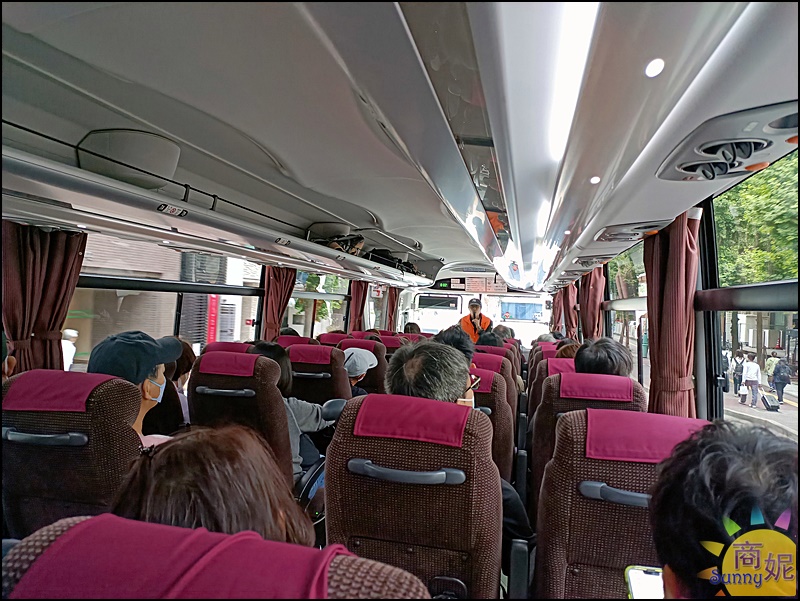
The width and height of the screenshot is (800, 601). In order to click on overhead storage in this screenshot , I will do `click(236, 234)`, `click(565, 229)`.